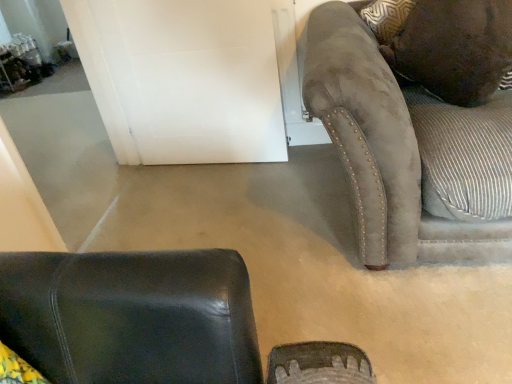
Question: From a real-world perspective, does white matte door at upper center sit lower than brown suede pillow at upper right?

Choices:
 (A) yes
 (B) no

Answer: (A)

Question: Can you see white matte door at upper center touching brown suede pillow at upper right?

Choices:
 (A) yes
 (B) no

Answer: (B)

Question: Is brown suede pillow at upper right inside white matte door at upper center?

Choices:
 (A) yes
 (B) no

Answer: (B)

Question: Can you confirm if white matte door at upper center is wider than brown suede pillow at upper right?

Choices:
 (A) yes
 (B) no

Answer: (B)

Question: Considering the relative sizes of white matte door at upper center and brown suede pillow at upper right in the image provided, is white matte door at upper center smaller than brown suede pillow at upper right?

Choices:
 (A) yes
 (B) no

Answer: (A)

Question: Considering the relative positions of suede couch at right and brown suede pillow at upper right in the image provided, is suede couch at right to the left or to the right of brown suede pillow at upper right?

Choices:
 (A) left
 (B) right

Answer: (B)

Question: From a real-world perspective, is suede couch at right above or below brown suede pillow at upper right?

Choices:
 (A) below
 (B) above

Answer: (A)

Question: From their relative heights in the image, would you say suede couch at right is taller or shorter than brown suede pillow at upper right?

Choices:
 (A) short
 (B) tall

Answer: (B)

Question: In the image, is suede couch at right positioned in front of or behind brown suede pillow at upper right?

Choices:
 (A) front
 (B) behind

Answer: (A)

Question: Is brown suede pillow at upper right spatially inside suede couch at right, or outside of it?

Choices:
 (A) inside
 (B) outside

Answer: (A)

Question: Is brown suede pillow at upper right in front of or behind suede couch at right in the image?

Choices:
 (A) behind
 (B) front

Answer: (A)

Question: Is point click(395, 1) closer or farther from the camera than point click(413, 238)?

Choices:
 (A) closer
 (B) farther

Answer: (B)

Question: Based on their positions, is brown suede pillow at upper right located to the left or right of suede couch at right?

Choices:
 (A) right
 (B) left

Answer: (B)

Question: Considering the positions of point (258, 150) and point (411, 11), is point (258, 150) closer or farther from the camera than point (411, 11)?

Choices:
 (A) farther
 (B) closer

Answer: (A)

Question: Is white matte door at upper center bigger or smaller than brown suede pillow at upper right?

Choices:
 (A) big
 (B) small

Answer: (B)